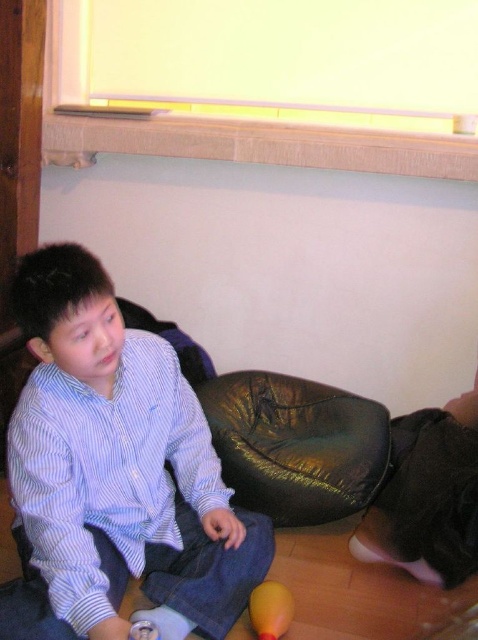
Question: Is yellow rubber ball at lower center further to the viewer compared to smooth plastic rattle at lower center?

Choices:
 (A) no
 (B) yes

Answer: (B)

Question: Which is farther from the smooth plastic rattle at lower center?

Choices:
 (A) blue striped shirt at center
 (B) shiny gold bean bag chair at center

Answer: (B)

Question: Does blue striped shirt at center appear on the left side of yellow rubber ball at lower center?

Choices:
 (A) no
 (B) yes

Answer: (B)

Question: Which point appears closest to the camera in this image?

Choices:
 (A) (272, 627)
 (B) (37, 403)
 (C) (145, 625)

Answer: (B)

Question: Does blue striped shirt at center appear on the left side of smooth plastic rattle at lower center?

Choices:
 (A) yes
 (B) no

Answer: (A)

Question: Which of these objects is positioned farthest from the yellow rubber ball at lower center?

Choices:
 (A) smooth plastic rattle at lower center
 (B) shiny gold bean bag chair at center
 (C) blue striped shirt at center

Answer: (B)